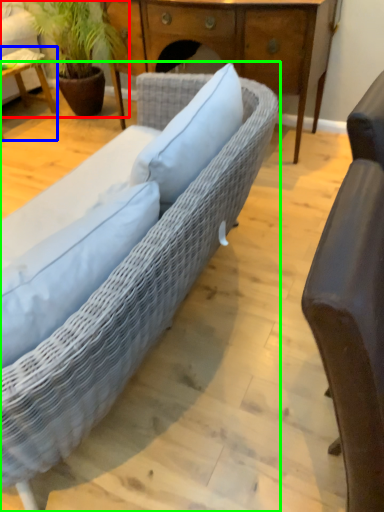
Question: Based on their relative distances, which object is farther from houseplant (highlighted by a red box)? Choose from table (highlighted by a blue box) and studio couch (highlighted by a green box).

Choices:
 (A) table
 (B) studio couch

Answer: (B)